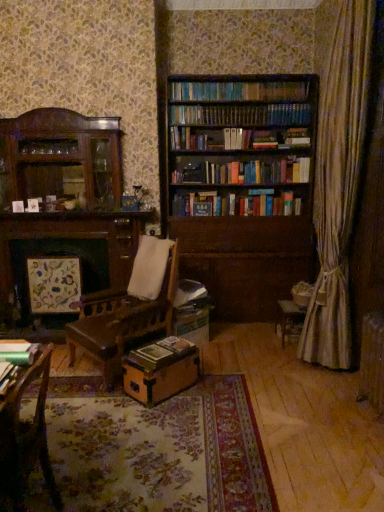
Question: From a real-world perspective, is metallic green book at lower left, placed as the second book when sorted from back to front, positioned under wooden chair at lower left based on gravity?

Choices:
 (A) yes
 (B) no

Answer: (B)

Question: From a real-world perspective, is metallic green book at lower left, the 2th book from the right, on wooden chair at lower left?

Choices:
 (A) no
 (B) yes

Answer: (B)

Question: From the image's perspective, is metallic green book at lower left, which ranks as the second book in bottom-to-top order, located beneath wooden chair at lower left?

Choices:
 (A) yes
 (B) no

Answer: (B)

Question: Can you confirm if metallic green book at lower left, the 2th book from the right, is smaller than wooden chair at lower left?

Choices:
 (A) no
 (B) yes

Answer: (B)

Question: Could wooden chair at lower left be considered to be inside metallic green book at lower left, which ranks as the second book in bottom-to-top order?

Choices:
 (A) no
 (B) yes

Answer: (A)

Question: Considering the relative positions of wooden chair at lower left and brown cardboard box at center in the image provided, is wooden chair at lower left to the left or to the right of brown cardboard box at center?

Choices:
 (A) right
 (B) left

Answer: (B)

Question: In the image, is wooden chair at lower left positioned in front of or behind brown cardboard box at center?

Choices:
 (A) behind
 (B) front

Answer: (B)

Question: From the image's perspective, is wooden chair at lower left positioned above or below brown cardboard box at center?

Choices:
 (A) below
 (B) above

Answer: (B)

Question: Based on their sizes in the image, would you say wooden chair at lower left is bigger or smaller than brown cardboard box at center?

Choices:
 (A) big
 (B) small

Answer: (A)

Question: Looking at the image, does hardcover book at center, the second book positioned from the front, seem bigger or smaller compared to wooden chair at lower left?

Choices:
 (A) big
 (B) small

Answer: (B)

Question: Does point (173, 353) appear closer or farther from the camera than point (23, 509)?

Choices:
 (A) farther
 (B) closer

Answer: (A)

Question: From the image's perspective, is hardcover book at center, which is the 2th book in left-to-right order, located above or below wooden chair at lower left?

Choices:
 (A) above
 (B) below

Answer: (A)

Question: From their relative heights in the image, would you say hardcover book at center, the second book positioned from the front, is taller or shorter than wooden chair at lower left?

Choices:
 (A) short
 (B) tall

Answer: (A)

Question: From the image's perspective, is metallic green book at lower left, which ranks as the second book in bottom-to-top order, above or below brown cardboard box at center?

Choices:
 (A) below
 (B) above

Answer: (B)

Question: In terms of height, does metallic green book at lower left, which ranks as the second book in bottom-to-top order, look taller or shorter compared to brown cardboard box at center?

Choices:
 (A) tall
 (B) short

Answer: (B)